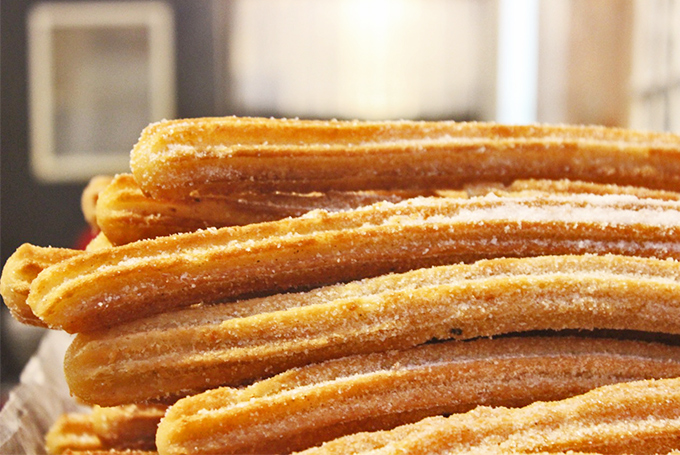
Identify the location of wall. (375, 57).